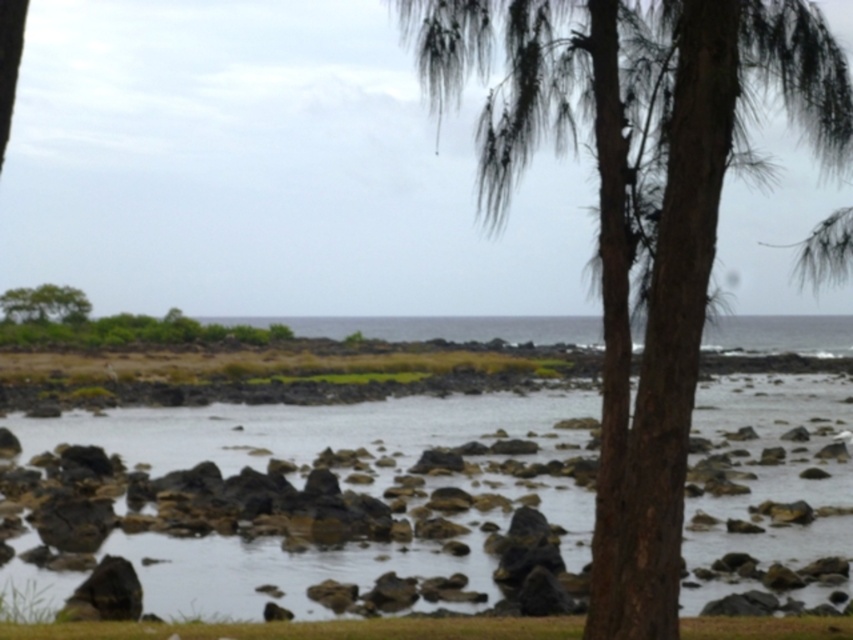
Question: In this image, where is clear water at center located relative to brown rough bark palm tree at right?

Choices:
 (A) below
 (B) above

Answer: (A)

Question: Which object is closer to the camera taking this photo?

Choices:
 (A) green leafy tree at upper left
 (B) clear water at center

Answer: (B)

Question: Does clear water at center have a smaller size compared to green leafy tree at upper left?

Choices:
 (A) no
 (B) yes

Answer: (A)

Question: Can you confirm if clear water at center is positioned above brown rough bark palm tree at right?

Choices:
 (A) no
 (B) yes

Answer: (A)

Question: Among these objects, which one is nearest to the camera?

Choices:
 (A) brown rough bark palm tree at right
 (B) clear water at center
 (C) green leafy tree at upper left

Answer: (A)

Question: Which point is farther from the camera taking this photo?

Choices:
 (A) (605, 321)
 (B) (103, 513)

Answer: (B)